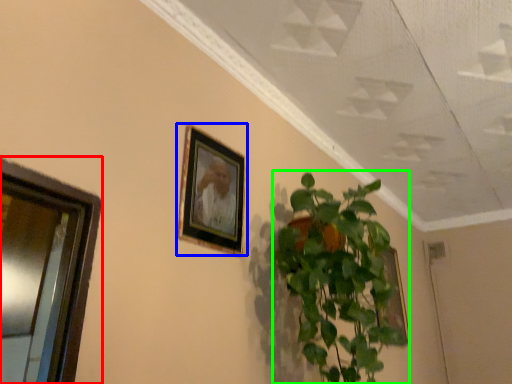
Question: Based on their relative distances, which object is nearer to window (highlighted by a red box)? Choose from picture frame (highlighted by a blue box) and houseplant (highlighted by a green box).

Choices:
 (A) picture frame
 (B) houseplant

Answer: (A)